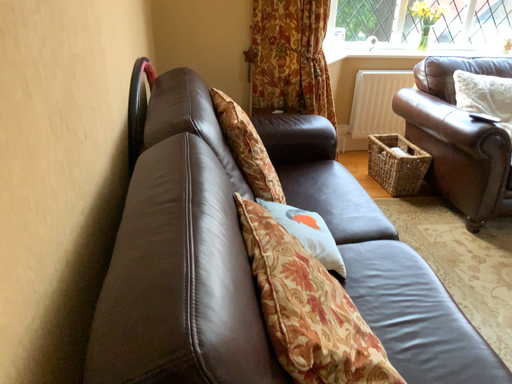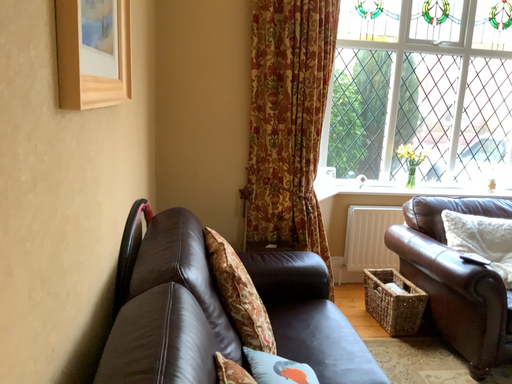
Question: How did the camera likely rotate when shooting the video?

Choices:
 (A) rotated downward
 (B) rotated upward

Answer: (B)